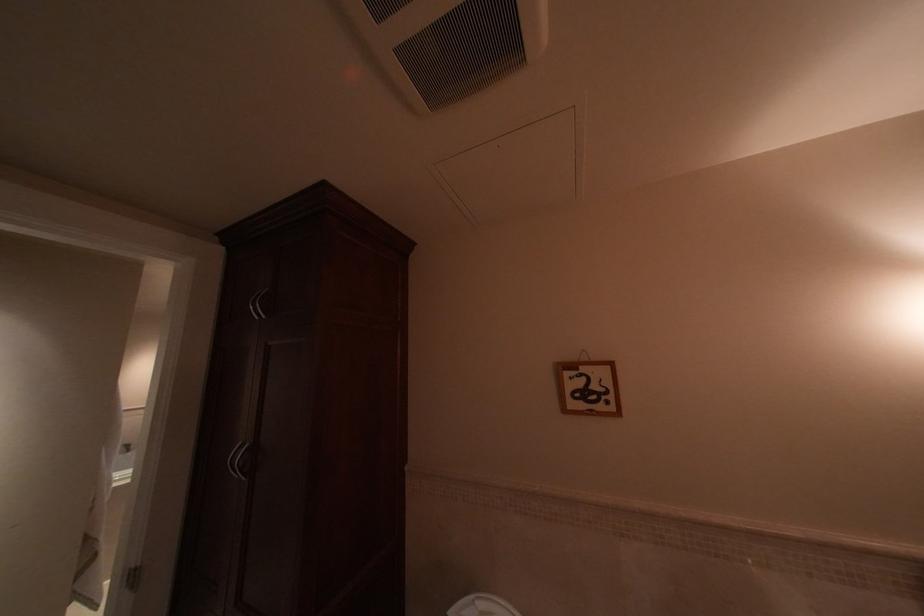
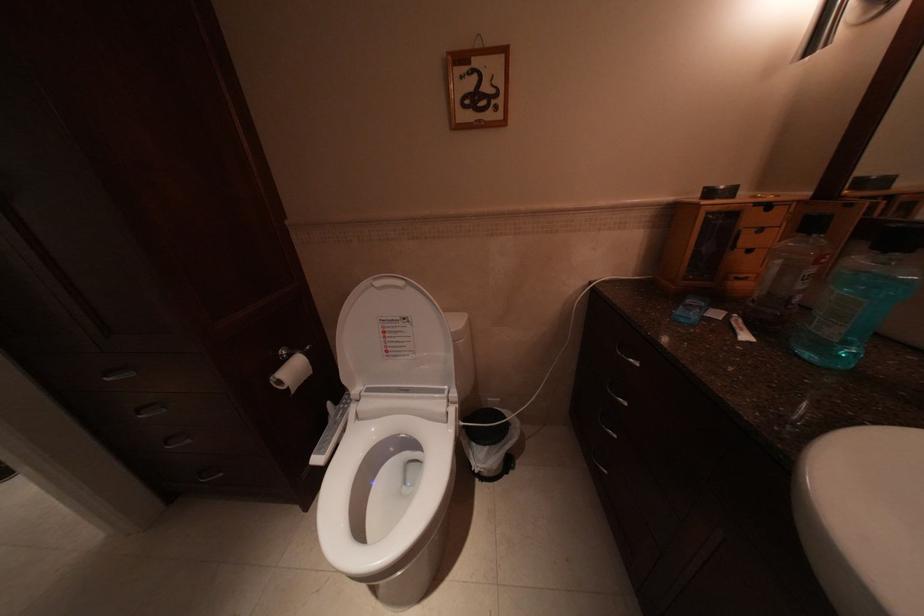
The first image is from the beginning of the video and the second image is from the end. How did the camera likely rotate when shooting the video?

The rotation direction of the camera is right-down.